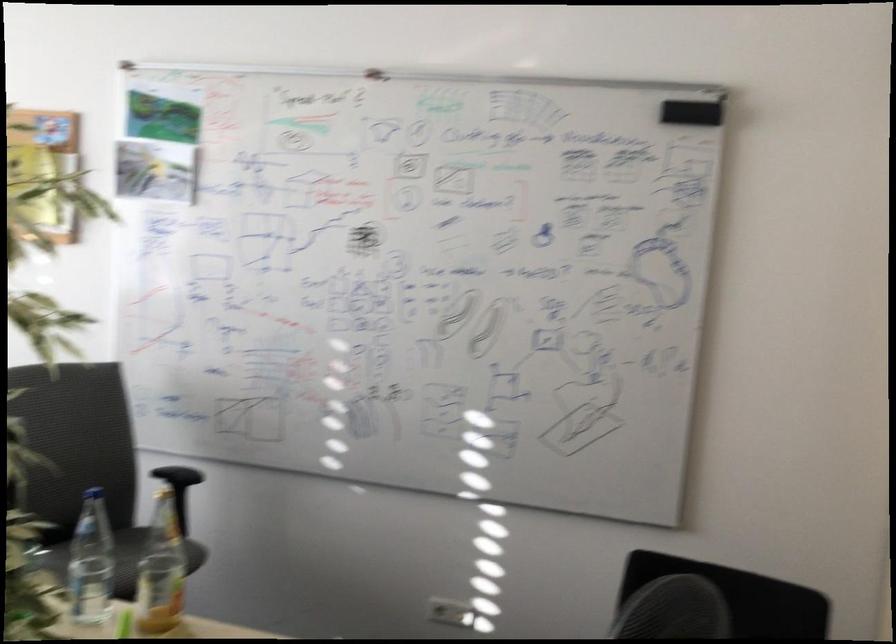
What do you see at coordinates (108, 556) in the screenshot? This screenshot has width=896, height=644. I see `a grey chair sitting surface` at bounding box center [108, 556].